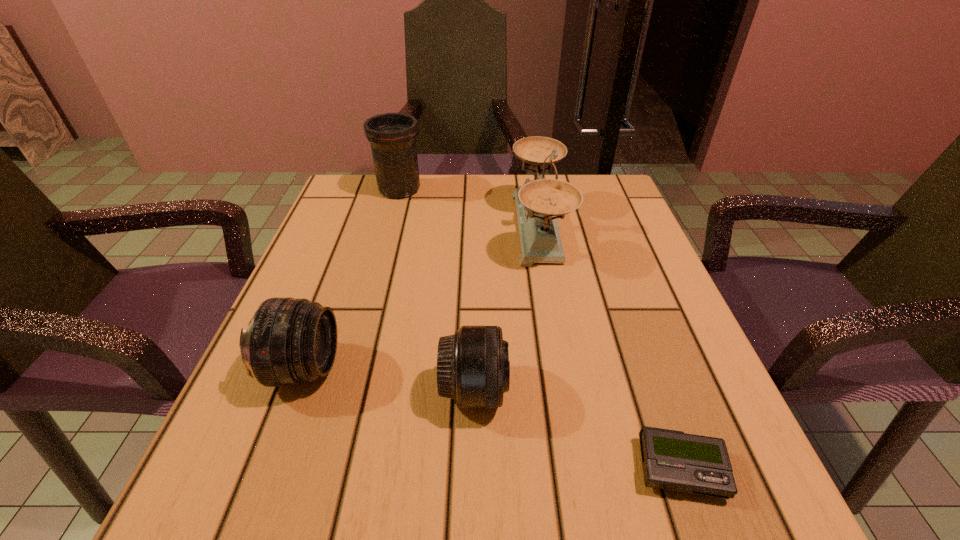
I want to click on vacant area situated on the back of the rightmost object, so click(x=632, y=328).

Find the location of a particular element. Image resolution: width=960 pixels, height=540 pixels. scale that is at the far edge is located at coordinates (539, 203).

At what (x,y) coordinates should I click in order to perform the action: click on telephoto lens present at the far edge. Please return your answer as a coordinate pair (x, y). The image size is (960, 540). Looking at the image, I should click on (392, 136).

I want to click on object that is at the near edge, so click(x=672, y=460).

Locate an element on the screen. object located at the right edge is located at coordinates (672, 460).

I want to click on object that is at the far left corner, so [392, 136].

Image resolution: width=960 pixels, height=540 pixels. I want to click on object at the near right corner, so click(x=672, y=460).

Where is `blank space at the far edge of the desktop`? The width and height of the screenshot is (960, 540). blank space at the far edge of the desktop is located at coordinates (430, 210).

In the image, there is a desktop. At what (x,y) coordinates should I click in order to perform the action: click on blank space at the left edge. Please return your answer as a coordinate pair (x, y). The height and width of the screenshot is (540, 960). Looking at the image, I should click on (348, 271).

Where is `free space at the right edge of the desktop`? This screenshot has height=540, width=960. free space at the right edge of the desktop is located at coordinates (650, 341).